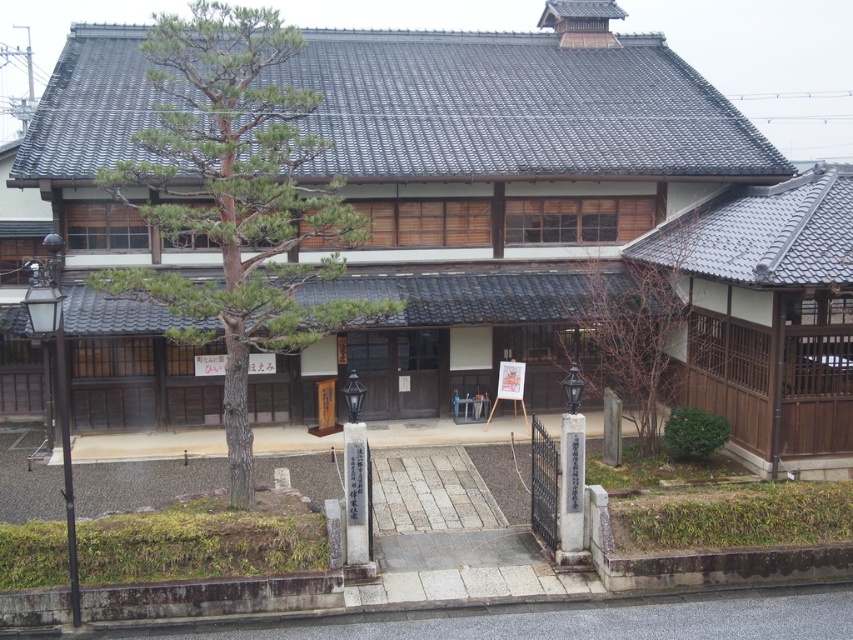
You are standing at the entrance of the traditional Japanese building and see a point marked at coordinates (235, 198). Which object is this point located on?

The point at (235, 198) is located on the green textured pine tree at center.

You are a delivery person with a cart that is 10 feet wide. You need to navigate between the green textured pine tree at center and the bare wood tree at center to reach the entrance of the traditional Japanese building. Can your cart fit through the space between them?

The distance between the green textured pine tree at center and the bare wood tree at center is 21.74 feet, which is wider than the cart width of 10 feet. Therefore, the cart can easily pass through the space between them.